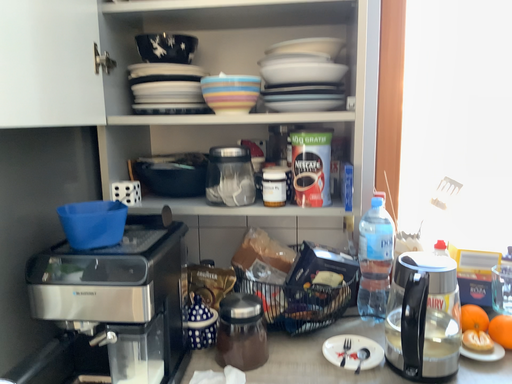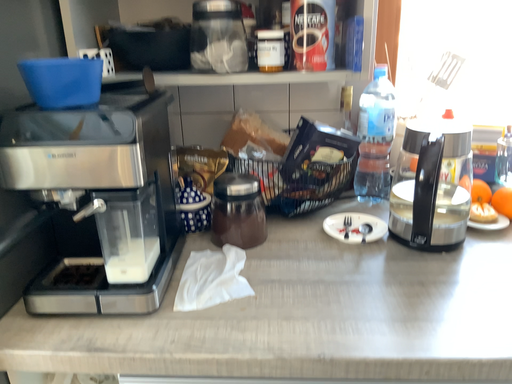
Question: Which way did the camera rotate in the video?

Choices:
 (A) rotated upward
 (B) rotated downward

Answer: (B)